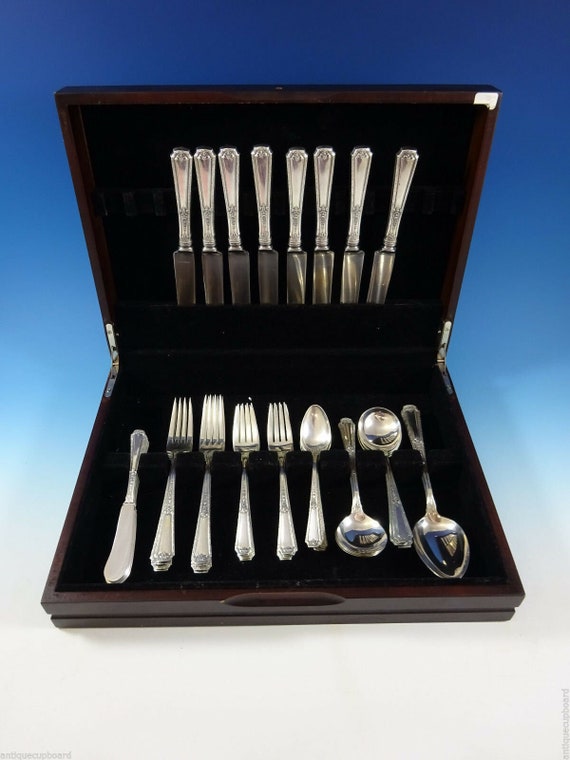
Where is `knives`? knives is located at coordinates (378, 290), (349, 280), (329, 279), (304, 277), (274, 277), (245, 277), (223, 277), (190, 277).